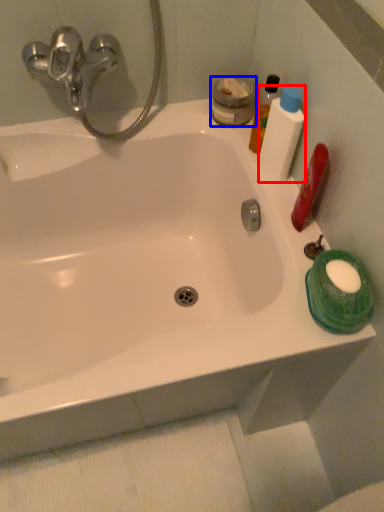
Question: Among these objects, which one is farthest to the camera, mouthwash (highlighted by a red box) or mouthwash (highlighted by a blue box)?

Choices:
 (A) mouthwash
 (B) mouthwash

Answer: (B)